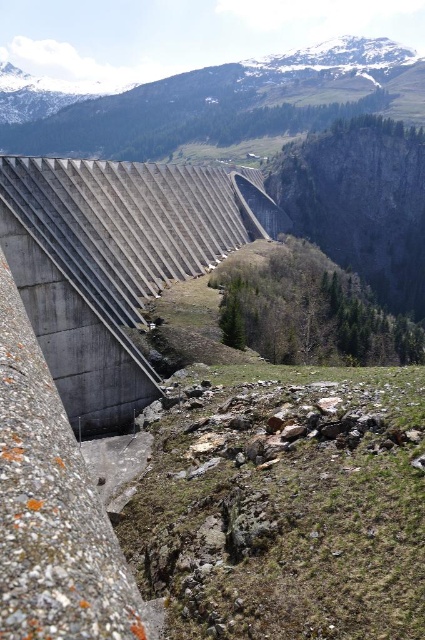
Does concrete dam at center appear on the right side of snowy granite mountain at upper center?

Indeed, concrete dam at center is positioned on the right side of snowy granite mountain at upper center.

Does concrete dam at center have a greater height compared to snowy granite mountain at upper center?

No, concrete dam at center is not taller than snowy granite mountain at upper center.

Between point (187, 264) and point (39, 129), which one is positioned in front?

Point (187, 264) is more forward.

Find the location of a particular element. The height and width of the screenshot is (640, 425). concrete dam at center is located at coordinates (115, 262).